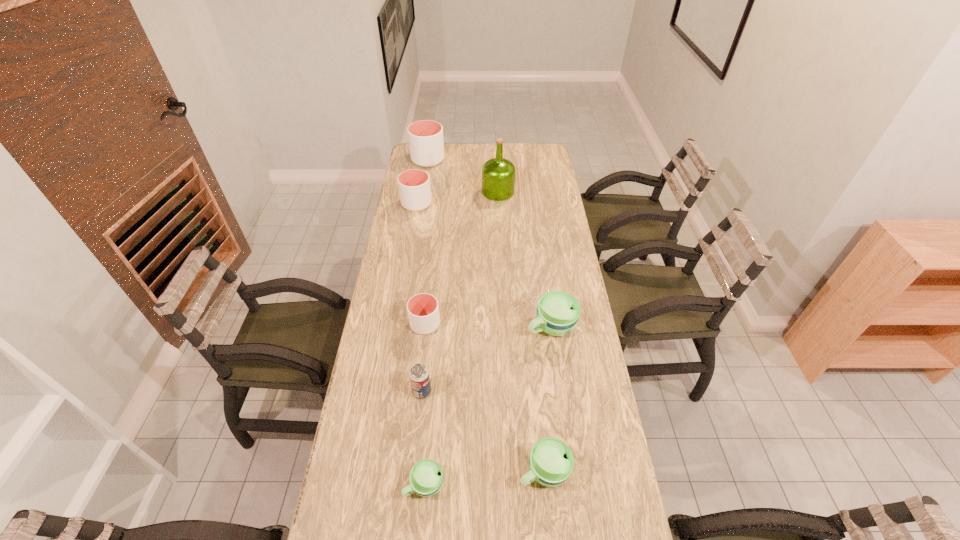
Where is `green olive oil`? This screenshot has width=960, height=540. green olive oil is located at coordinates (498, 174).

Locate an element on the screen. The width and height of the screenshot is (960, 540). olive oil is located at coordinates (498, 174).

Identify the location of the second tallest object. (426, 144).

Locate an element on the screen. The image size is (960, 540). the biggest white cup is located at coordinates (426, 144).

Identify the location of the second tallest cup. (414, 185).

Where is `the second biggest white cup`? the second biggest white cup is located at coordinates (414, 185).

Image resolution: width=960 pixels, height=540 pixels. In order to click on the third nearest object in this screenshot , I will do click(419, 377).

Where is `beer can`? The width and height of the screenshot is (960, 540). beer can is located at coordinates (419, 377).

Where is `the biggest blue cup`? Image resolution: width=960 pixels, height=540 pixels. the biggest blue cup is located at coordinates (558, 312).

Identify the location of the smallest white cup. The image size is (960, 540). (423, 311).